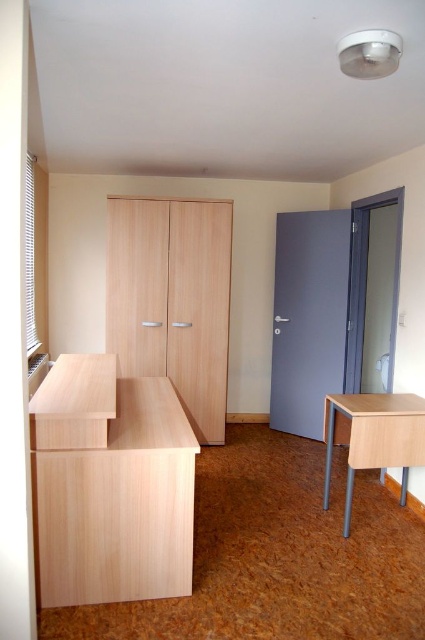
You are standing in the room and want to place a small plant on the desk. The desk has a matte wood drawer at lower left. Where should you place the plant to avoid blocking the drawer?

You should place the plant on the desk but away from the matte wood drawer at lower left, ensuring it does not block the drawer.